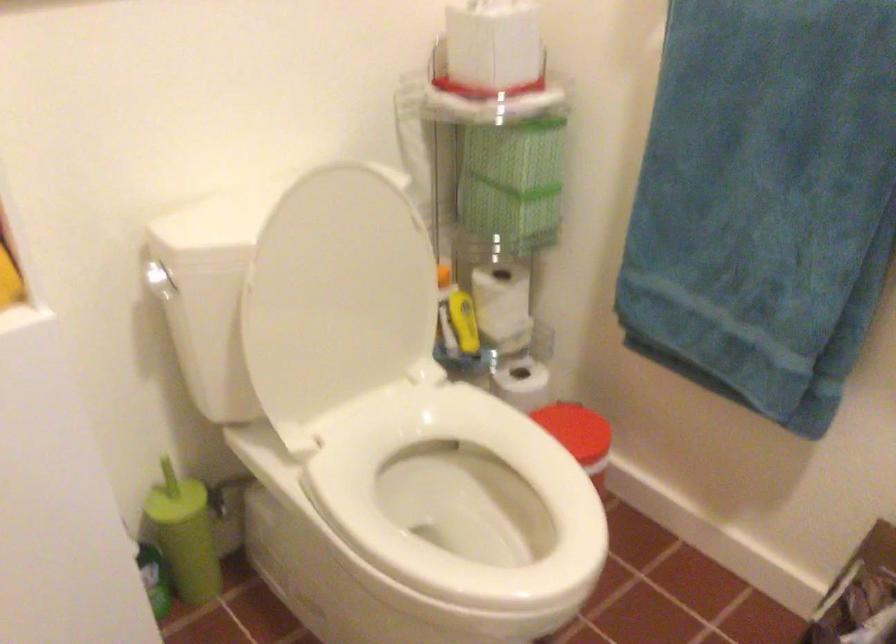
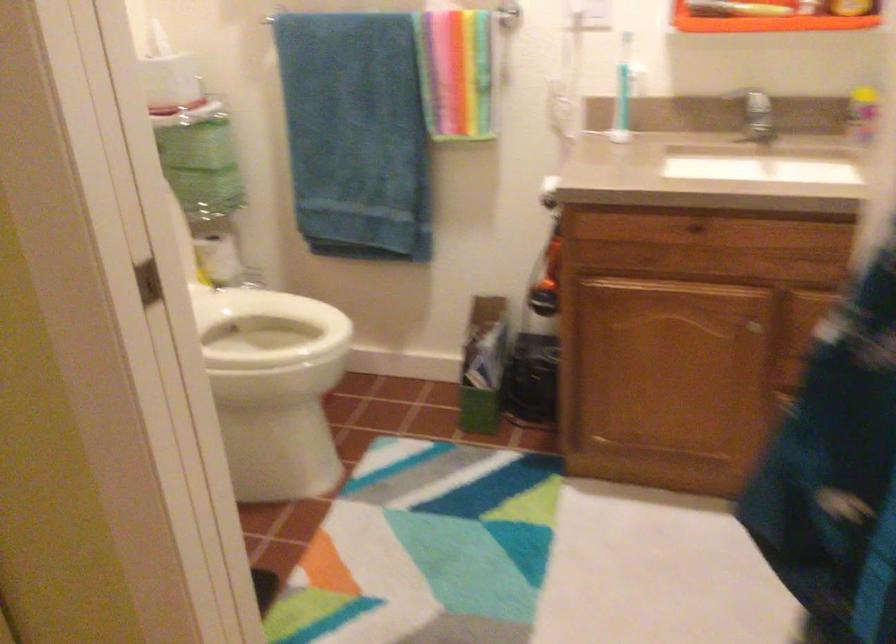
Find the pixel in the second image that matches (504,310) in the first image.

(219, 259)